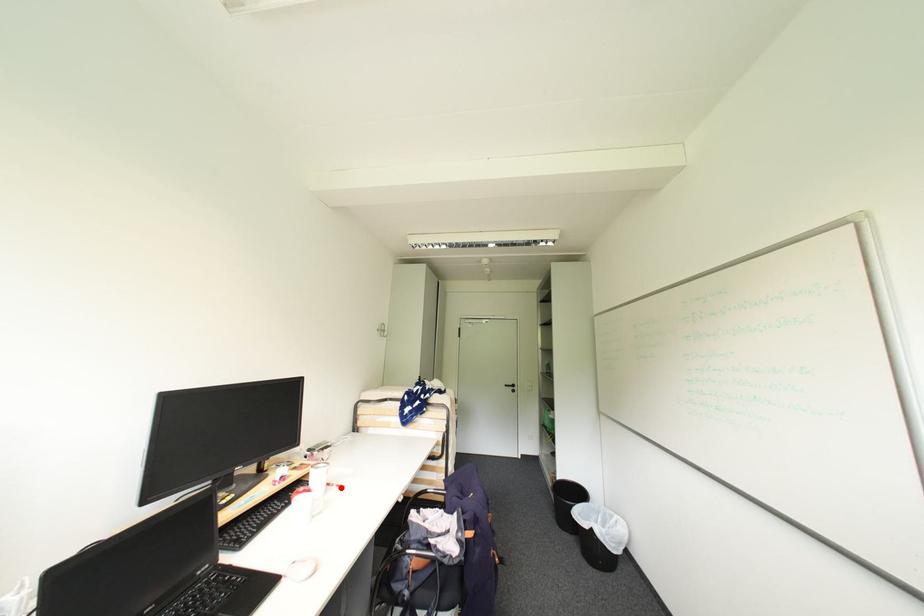
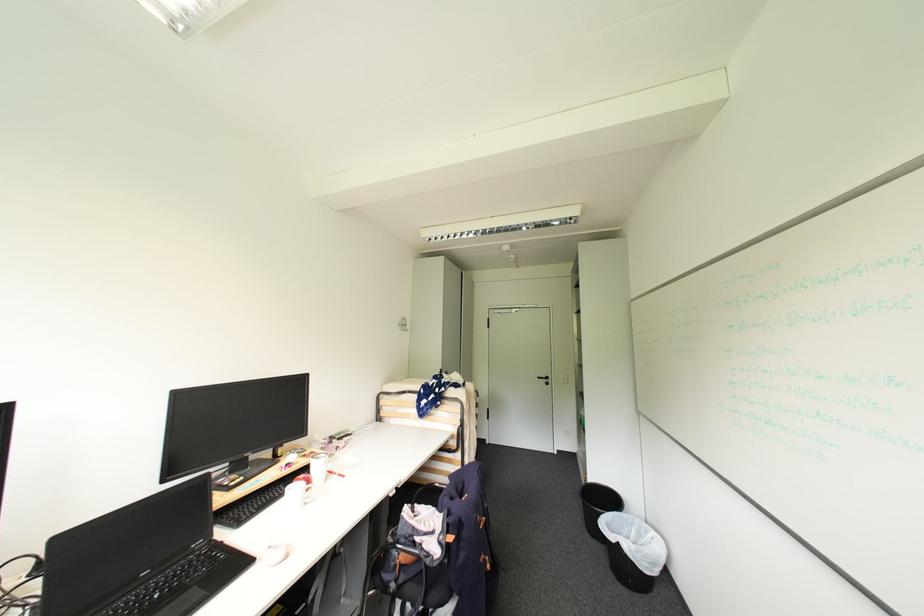
Where in the second image is the point corresponding to the highlighted location from the first image?

(343, 477)